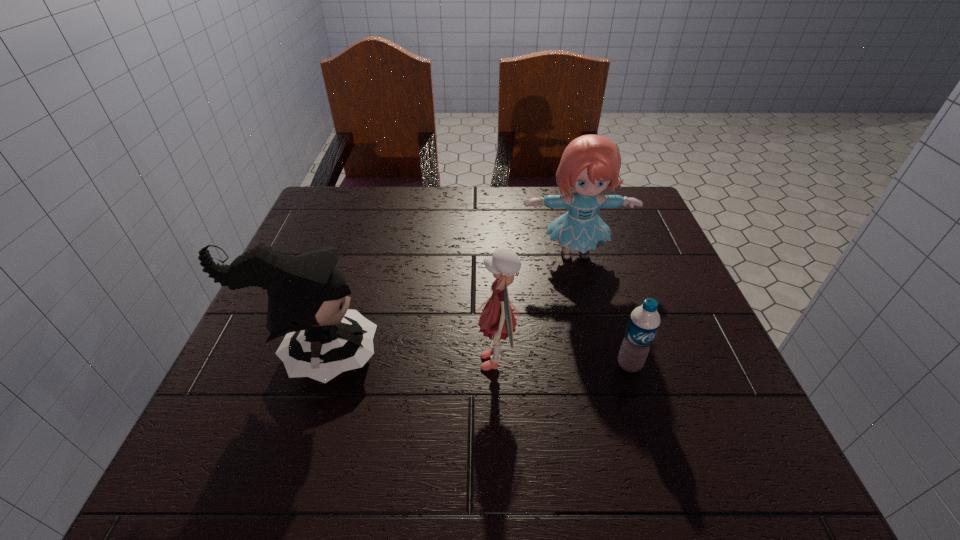
Where is `the farthest doll`? Image resolution: width=960 pixels, height=540 pixels. the farthest doll is located at coordinates (590, 163).

The image size is (960, 540). I want to click on the rightmost doll, so click(x=590, y=163).

This screenshot has height=540, width=960. What are the coordinates of `the leftmost doll` in the screenshot? It's located at (307, 295).

This screenshot has height=540, width=960. Identify the location of the second doll from right to left. (498, 320).

Find the location of a particular element. the shortest object is located at coordinates (644, 321).

The width and height of the screenshot is (960, 540). Find the location of `vacant space located 0.060m on the front-facing side of the rightmost doll`. vacant space located 0.060m on the front-facing side of the rightmost doll is located at coordinates (584, 293).

Where is `vacant space located at the face of the leftmost doll`? The height and width of the screenshot is (540, 960). vacant space located at the face of the leftmost doll is located at coordinates (591, 356).

Where is `vacant space positioned 0.230m on the front-facing side of the second object from left to right`? The width and height of the screenshot is (960, 540). vacant space positioned 0.230m on the front-facing side of the second object from left to right is located at coordinates coord(352,362).

Where is `vacant space located on the front-facing side of the second object from left to right`? vacant space located on the front-facing side of the second object from left to right is located at coordinates (289, 362).

Where is `vacant area located 0.290m on the front-facing side of the second object from left to right`? The width and height of the screenshot is (960, 540). vacant area located 0.290m on the front-facing side of the second object from left to right is located at coordinates (321, 362).